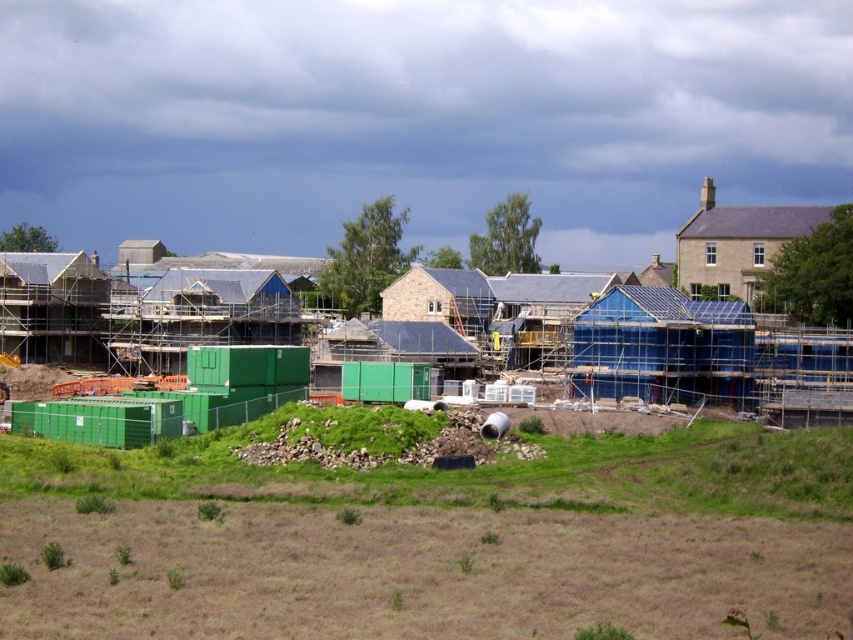
Question: Which point appears closest to the camera in this image?

Choices:
 (A) (334, 388)
 (B) (625, 595)

Answer: (B)

Question: Is green grass at lower center to the left of green plastic containers at center from the viewer's perspective?

Choices:
 (A) yes
 (B) no

Answer: (B)

Question: Among these objects, which one is farthest from the camera?

Choices:
 (A) green grass at lower center
 (B) green plastic containers at center

Answer: (B)

Question: Which point appears farthest from the camera in this image?

Choices:
 (A) (517, 401)
 (B) (811, 445)

Answer: (A)

Question: Is green grass at lower center to the left of green plastic containers at center from the viewer's perspective?

Choices:
 (A) yes
 (B) no

Answer: (B)

Question: In this image, where is green grass at lower center located relative to green plastic containers at center?

Choices:
 (A) left
 (B) right

Answer: (B)